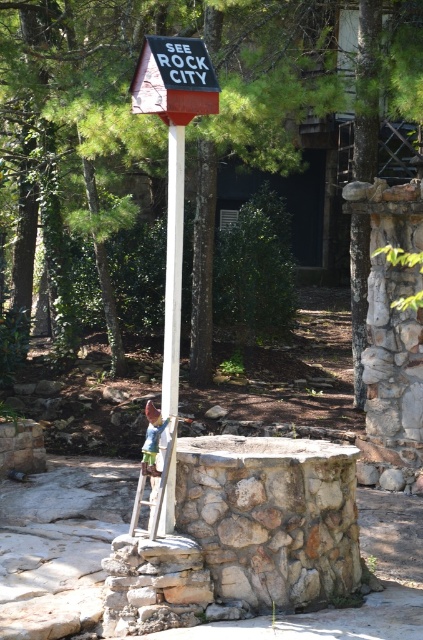
Who is taller, red painted wood sign at center or white plastic pole at center?

red painted wood sign at center

Who is shorter, red painted wood sign at center or white plastic pole at center?

With less height is white plastic pole at center.

I want to click on red painted wood sign at center, so click(x=173, y=161).

I want to click on red painted wood sign at center, so click(173, 161).

Is point (180, 84) less distant than point (131, 524)?

Yes.

The height and width of the screenshot is (640, 423). What are the coordinates of `red painted wood sign at center` in the screenshot? It's located at (173, 161).

Consider the image. Which of these two, white plastic pole at center or wooden at lower center, stands shorter?

With less height is wooden at lower center.

Does point (172, 230) lie behind point (159, 474)?

No, (172, 230) is closer to viewer.

You are a GUI agent. You are given a task and a screenshot of the screen. Output one action in this format:
    pyautogui.click(x=<x>, y=<y>)
    Task: Click on the white plastic pole at center
    This screenshot has height=640, width=423.
    Given the screenshot: What is the action you would take?
    pyautogui.click(x=173, y=269)